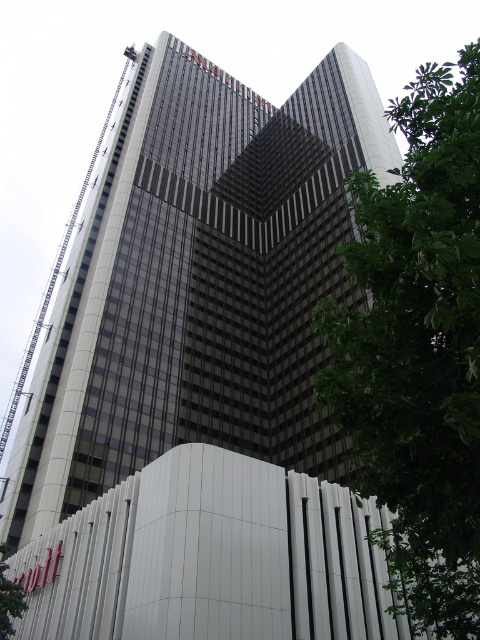
Who is positioned more to the right, glassy reflective skyscraper at center or green leafy tree at right?

green leafy tree at right is more to the right.

Does glassy reflective skyscraper at center appear on the left side of green leafy tree at right?

Yes, glassy reflective skyscraper at center is to the left of green leafy tree at right.

Is point (12, 529) behind point (477, 424)?

Yes.

At what (x,y) coordinates should I click in order to perform the action: click on glassy reflective skyscraper at center. Please return your answer as a coordinate pair (x, y). This screenshot has height=640, width=480. Looking at the image, I should click on (197, 282).